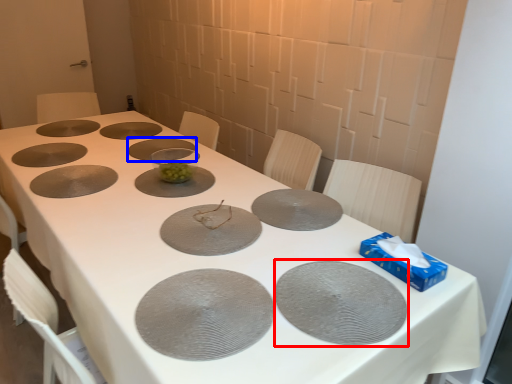
Question: Which object is closer to the camera taking this photo, glass plate (highlighted by a red box) or glass plate (highlighted by a blue box)?

Choices:
 (A) glass plate
 (B) glass plate

Answer: (A)